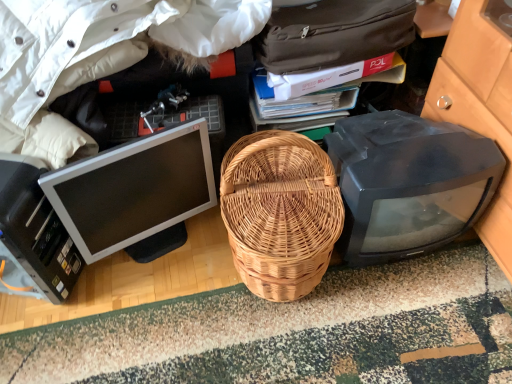
At what (x,y) coordinates should I click in order to perform the action: click on free space between white glossy computer monitor at left, the 1th computer monitor when ordered from left to right, and natural wicker picnic basket at center. Please return your answer as a coordinate pair (x, y). Looking at the image, I should click on pos(185,278).